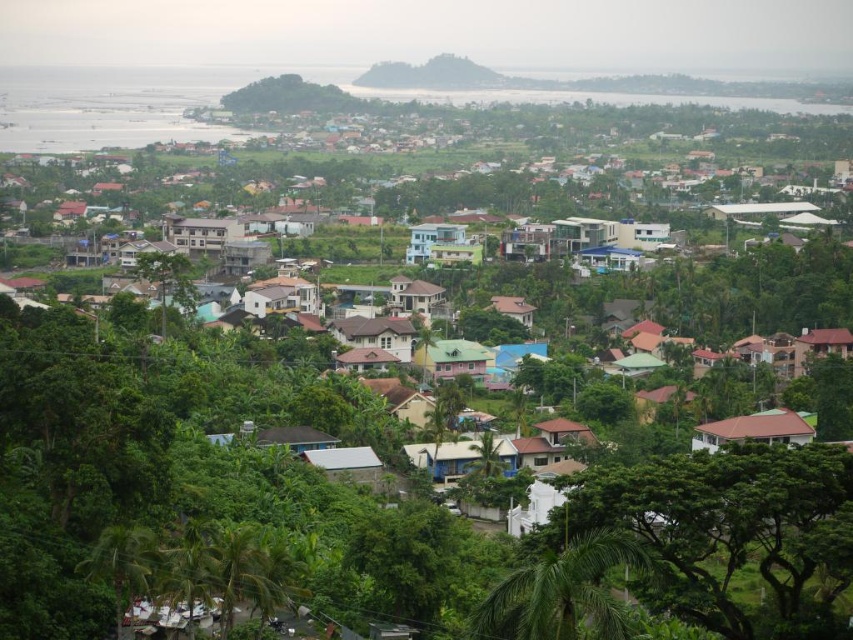
Is point (827, 576) farther from camera compared to point (582, 605)?

Yes, point (827, 576) is behind point (582, 605).

Can you confirm if green leafy tree at lower right is positioned below green leafy palm at center?

Indeed, green leafy tree at lower right is positioned under green leafy palm at center.

Image resolution: width=853 pixels, height=640 pixels. What do you see at coordinates (728, 532) in the screenshot?
I see `green leafy tree at lower right` at bounding box center [728, 532].

Where is `green leafy tree at lower right`? The height and width of the screenshot is (640, 853). green leafy tree at lower right is located at coordinates (728, 532).